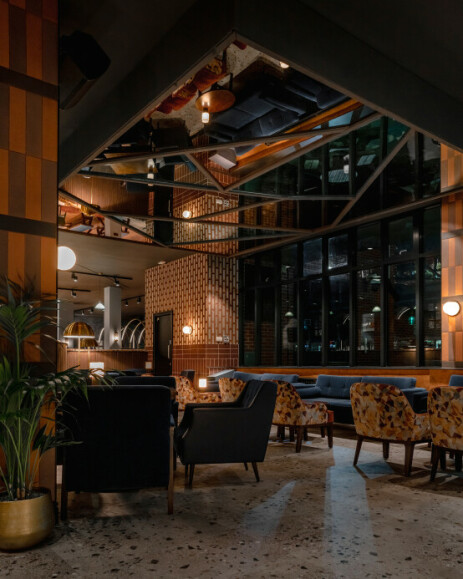
Identify the location of chairs. (135, 437), (242, 423), (153, 379), (195, 395), (230, 383), (295, 415), (371, 413), (444, 409), (127, 372).